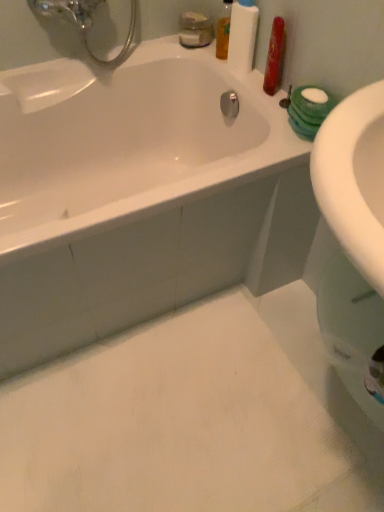
The height and width of the screenshot is (512, 384). Describe the element at coordinates (195, 30) in the screenshot. I see `translucent plastic mouthwash at upper center, placed as the second mouthwash when sorted from right to left` at that location.

The height and width of the screenshot is (512, 384). What do you see at coordinates (242, 35) in the screenshot?
I see `white matte bottle at upper right` at bounding box center [242, 35].

The width and height of the screenshot is (384, 512). Identify the location of white glossy bathtub at upper left. pos(139,196).

This screenshot has height=512, width=384. Describe the element at coordinates (223, 30) in the screenshot. I see `translucent orange liquid at upper right, the 2th mouthwash from the left` at that location.

The width and height of the screenshot is (384, 512). What are the coordinates of `translucent plastic mouthwash at upper center, placed as the second mouthwash when sorted from right to left` in the screenshot? It's located at (195, 30).

Is translucent orange liquid at upper right, the first mouthwash viewed from the right, bigger than white glossy bathtub at upper left?

Actually, translucent orange liquid at upper right, the first mouthwash viewed from the right, might be smaller than white glossy bathtub at upper left.

Based on the photo, between translucent orange liquid at upper right, the 2th mouthwash from the left, and white glossy bathtub at upper left, which one has more height?

white glossy bathtub at upper left is taller.

Is translucent orange liquid at upper right, the first mouthwash viewed from the right, positioned beyond the bounds of white glossy bathtub at upper left?

Yes, translucent orange liquid at upper right, the first mouthwash viewed from the right, is located beyond the bounds of white glossy bathtub at upper left.

Locate an element on the screen. mouthwash that is the 1st one when counting upward from the white glossy bathtub at upper left (from the image's perspective) is located at coordinates [223, 30].

From a real-world perspective, between white glossy bathtub at upper left and translucent orange liquid at upper right, the 2th mouthwash from the left, who is vertically higher?

From a 3D spatial view, translucent orange liquid at upper right, the 2th mouthwash from the left, is above.

Image resolution: width=384 pixels, height=512 pixels. I want to click on bathtub located below the translucent orange liquid at upper right, the 2th mouthwash from the left (from the image's perspective), so click(x=139, y=196).

Between white glossy bathtub at upper left and translucent orange liquid at upper right, the first mouthwash viewed from the right, which one has larger width?

With larger width is white glossy bathtub at upper left.

Is white glossy bathtub at upper left oriented towards translucent orange liquid at upper right, the first mouthwash viewed from the right?

No, white glossy bathtub at upper left is not facing towards translucent orange liquid at upper right, the first mouthwash viewed from the right.

Looking at this image, can you tell me how much translucent orange liquid at upper right, the first mouthwash viewed from the right, and white matte bottle at upper right differ in facing direction?

0.00022 degrees.

Which mouthwash is the 1st one when counting from the left side of the white matte bottle at upper right? Please provide its 2D coordinates.

[(223, 30)]

Based on the photo, from a real-world perspective, is translucent orange liquid at upper right, the 2th mouthwash from the left, positioned above or below white matte bottle at upper right?

Clearly, from a real-world perspective, translucent orange liquid at upper right, the 2th mouthwash from the left, is below white matte bottle at upper right.

Between translucent orange liquid at upper right, the first mouthwash viewed from the right, and white matte bottle at upper right, which one is positioned behind?

translucent orange liquid at upper right, the first mouthwash viewed from the right, is further away from the camera.

Would you consider white matte bottle at upper right to be distant from white glossy bathtub at upper left?

No, white matte bottle at upper right is in close proximity to white glossy bathtub at upper left.

Considering the relative sizes of white matte bottle at upper right and white glossy bathtub at upper left in the image provided, is white matte bottle at upper right wider than white glossy bathtub at upper left?

No, white matte bottle at upper right is not wider than white glossy bathtub at upper left.

How much distance is there between white matte bottle at upper right and white glossy bathtub at upper left?

A distance of 50.39 centimeters exists between white matte bottle at upper right and white glossy bathtub at upper left.

Can you confirm if white matte bottle at upper right is shorter than white glossy bathtub at upper left?

Indeed, white matte bottle at upper right has a lesser height compared to white glossy bathtub at upper left.

Which object is positioned more to the left, white glossy bathtub at upper left or white matte bottle at upper right?

Positioned to the left is white glossy bathtub at upper left.

Is white glossy bathtub at upper left not close to white matte bottle at upper right?

white glossy bathtub at upper left is near white matte bottle at upper right, not far away.

Which is closer to the camera, (67, 82) or (251, 38)?

Point (67, 82) appears to be farther away from the viewer than point (251, 38).

Does white glossy bathtub at upper left contain white matte bottle at upper right?

That's incorrect, white matte bottle at upper right is not inside white glossy bathtub at upper left.

Is white matte bottle at upper right not near translucent orange liquid at upper right, the first mouthwash viewed from the right?

They are positioned close to each other.

Between white matte bottle at upper right and translucent orange liquid at upper right, the 2th mouthwash from the left, which one has larger width?

white matte bottle at upper right.

Does point (251, 10) come closer to viewer compared to point (227, 44)?

Yes, point (251, 10) is closer to viewer.

Can translucent orange liquid at upper right, the first mouthwash viewed from the right, be found inside white matte bottle at upper right?

No, white matte bottle at upper right does not contain translucent orange liquid at upper right, the first mouthwash viewed from the right.

Is translucent plastic mouthwash at upper center, placed as the second mouthwash when sorted from right to left, facing away from translucent orange liquid at upper right, the 2th mouthwash from the left?

That's not correct — translucent plastic mouthwash at upper center, placed as the second mouthwash when sorted from right to left, is not looking away from translucent orange liquid at upper right, the 2th mouthwash from the left.

Is translucent plastic mouthwash at upper center, placed as the second mouthwash when sorted from right to left, surrounding translucent orange liquid at upper right, the first mouthwash viewed from the right?

No, translucent orange liquid at upper right, the first mouthwash viewed from the right, is not a part of translucent plastic mouthwash at upper center, placed as the second mouthwash when sorted from right to left.

Which object is further away from the camera, translucent plastic mouthwash at upper center, acting as the 1th mouthwash starting from the left, or translucent orange liquid at upper right, the 2th mouthwash from the left?

translucent plastic mouthwash at upper center, acting as the 1th mouthwash starting from the left, is more distant.

From the picture: In terms of height, does translucent plastic mouthwash at upper center, acting as the 1th mouthwash starting from the left, look taller or shorter compared to translucent orange liquid at upper right, the 2th mouthwash from the left?

translucent plastic mouthwash at upper center, acting as the 1th mouthwash starting from the left, is shorter than translucent orange liquid at upper right, the 2th mouthwash from the left.

Which mouthwash is the 2nd one when counting from the right side of the white glossy bathtub at upper left? Please provide its 2D coordinates.

[(223, 30)]

You are a GUI agent. You are given a task and a screenshot of the screen. Output one action in this format:
    pyautogui.click(x=<x>, y=<y>)
    Task: Click on the bathtub on the left of translucent orange liquid at upper right, the 2th mouthwash from the left
    Image resolution: width=384 pixels, height=512 pixels.
    Given the screenshot: What is the action you would take?
    pyautogui.click(x=139, y=196)

Which object lies further to the anchor point translucent plastic mouthwash at upper center, acting as the 1th mouthwash starting from the left, white glossy bathtub at upper left or translucent orange liquid at upper right, the first mouthwash viewed from the right?

white glossy bathtub at upper left is positioned further to the anchor translucent plastic mouthwash at upper center, acting as the 1th mouthwash starting from the left.

When comparing their distances from white glossy bathtub at upper left, does translucent plastic mouthwash at upper center, placed as the second mouthwash when sorted from right to left, or translucent orange liquid at upper right, the 2th mouthwash from the left, seem closer?

Among the two, translucent plastic mouthwash at upper center, placed as the second mouthwash when sorted from right to left, is located nearer to white glossy bathtub at upper left.

Considering their positions, is white matte bottle at upper right positioned closer to white glossy bathtub at upper left than translucent orange liquid at upper right, the first mouthwash viewed from the right?

The object closer to white glossy bathtub at upper left is white matte bottle at upper right.

Looking at the image, which one is located closer to white matte bottle at upper right, white glossy bathtub at upper left or translucent orange liquid at upper right, the 2th mouthwash from the left?

translucent orange liquid at upper right, the 2th mouthwash from the left.

Considering their positions, is translucent plastic mouthwash at upper center, acting as the 1th mouthwash starting from the left, positioned closer to white matte bottle at upper right than white glossy bathtub at upper left?

translucent plastic mouthwash at upper center, acting as the 1th mouthwash starting from the left, is closer to white matte bottle at upper right.

From the image, which object appears to be farther from translucent orange liquid at upper right, the first mouthwash viewed from the right, white glossy bathtub at upper left or translucent plastic mouthwash at upper center, acting as the 1th mouthwash starting from the left?

white glossy bathtub at upper left is positioned further to the anchor translucent orange liquid at upper right, the first mouthwash viewed from the right.

Which object lies further to the anchor point white matte bottle at upper right, white glossy bathtub at upper left or translucent plastic mouthwash at upper center, acting as the 1th mouthwash starting from the left?

white glossy bathtub at upper left lies further to white matte bottle at upper right than the other object.

Which object lies nearer to the anchor point white glossy bathtub at upper left, translucent orange liquid at upper right, the first mouthwash viewed from the right, or translucent plastic mouthwash at upper center, acting as the 1th mouthwash starting from the left?

translucent plastic mouthwash at upper center, acting as the 1th mouthwash starting from the left, is closer to white glossy bathtub at upper left.

Where is `mouthwash positioned between white matte bottle at upper right and translucent plastic mouthwash at upper center, acting as the 1th mouthwash starting from the left, from near to far`? mouthwash positioned between white matte bottle at upper right and translucent plastic mouthwash at upper center, acting as the 1th mouthwash starting from the left, from near to far is located at coordinates (223, 30).

At what (x,y) coordinates should I click in order to perform the action: click on cleaning product between translucent orange liquid at upper right, the first mouthwash viewed from the right, and white glossy bathtub at upper left in the up-down direction. Please return your answer as a coordinate pair (x, y). Looking at the image, I should click on (242, 35).

Where is `mouthwash that lies between translucent plastic mouthwash at upper center, placed as the second mouthwash when sorted from right to left, and white glossy bathtub at upper left from top to bottom`? mouthwash that lies between translucent plastic mouthwash at upper center, placed as the second mouthwash when sorted from right to left, and white glossy bathtub at upper left from top to bottom is located at coordinates (223, 30).

At what (x,y) coordinates should I click in order to perform the action: click on cleaning product between translucent plastic mouthwash at upper center, acting as the 1th mouthwash starting from the left, and white glossy bathtub at upper left in the up-down direction. Please return your answer as a coordinate pair (x, y). Looking at the image, I should click on (242, 35).